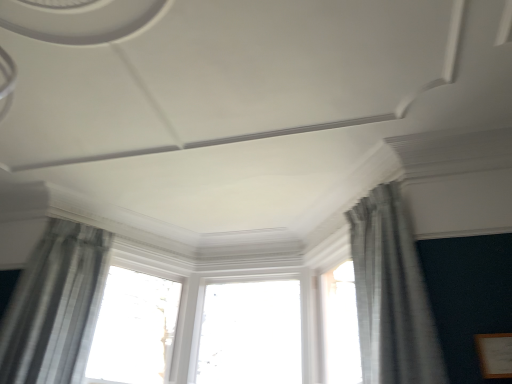
Question: Is sheer gray curtain at left, marked as the second curtain in a right-to-left arrangement, further to the viewer compared to white glossy window at center?

Choices:
 (A) yes
 (B) no

Answer: (B)

Question: From the image's perspective, is sheer gray curtain at left, marked as the second curtain in a right-to-left arrangement, located above white glossy window at center?

Choices:
 (A) no
 (B) yes

Answer: (B)

Question: From a real-world perspective, is sheer gray curtain at left, the 1th curtain positioned from the left, located higher than white glossy window at center?

Choices:
 (A) no
 (B) yes

Answer: (A)

Question: Is sheer gray curtain at left, marked as the second curtain in a right-to-left arrangement, to the left of white glossy window at center from the viewer's perspective?

Choices:
 (A) no
 (B) yes

Answer: (B)

Question: Considering the relative sizes of sheer gray curtain at left, marked as the second curtain in a right-to-left arrangement, and white glossy window at center in the image provided, is sheer gray curtain at left, marked as the second curtain in a right-to-left arrangement, smaller than white glossy window at center?

Choices:
 (A) no
 (B) yes

Answer: (A)

Question: Is sheer gray curtain at left, the 1th curtain positioned from the left, surrounding white glossy window at center?

Choices:
 (A) yes
 (B) no

Answer: (B)

Question: Could you tell me if sheer gray curtain at left, the 1th curtain positioned from the left, is facing gray sheer curtain at upper right, the 2th curtain positioned from the left?

Choices:
 (A) yes
 (B) no

Answer: (B)

Question: Does sheer gray curtain at left, marked as the second curtain in a right-to-left arrangement, have a larger size compared to gray sheer curtain at upper right, acting as the 1th curtain starting from the right?

Choices:
 (A) no
 (B) yes

Answer: (B)

Question: Can you confirm if sheer gray curtain at left, marked as the second curtain in a right-to-left arrangement, is thinner than gray sheer curtain at upper right, acting as the 1th curtain starting from the right?

Choices:
 (A) yes
 (B) no

Answer: (A)

Question: From the image's perspective, is sheer gray curtain at left, the 1th curtain positioned from the left, over gray sheer curtain at upper right, acting as the 1th curtain starting from the right?

Choices:
 (A) no
 (B) yes

Answer: (A)

Question: Is sheer gray curtain at left, marked as the second curtain in a right-to-left arrangement, located outside gray sheer curtain at upper right, the 2th curtain positioned from the left?

Choices:
 (A) yes
 (B) no

Answer: (A)

Question: Is sheer gray curtain at left, marked as the second curtain in a right-to-left arrangement, shorter than gray sheer curtain at upper right, acting as the 1th curtain starting from the right?

Choices:
 (A) no
 (B) yes

Answer: (A)

Question: Does white glossy window at center have a lesser width compared to gray sheer curtain at upper right, the 2th curtain positioned from the left?

Choices:
 (A) no
 (B) yes

Answer: (B)